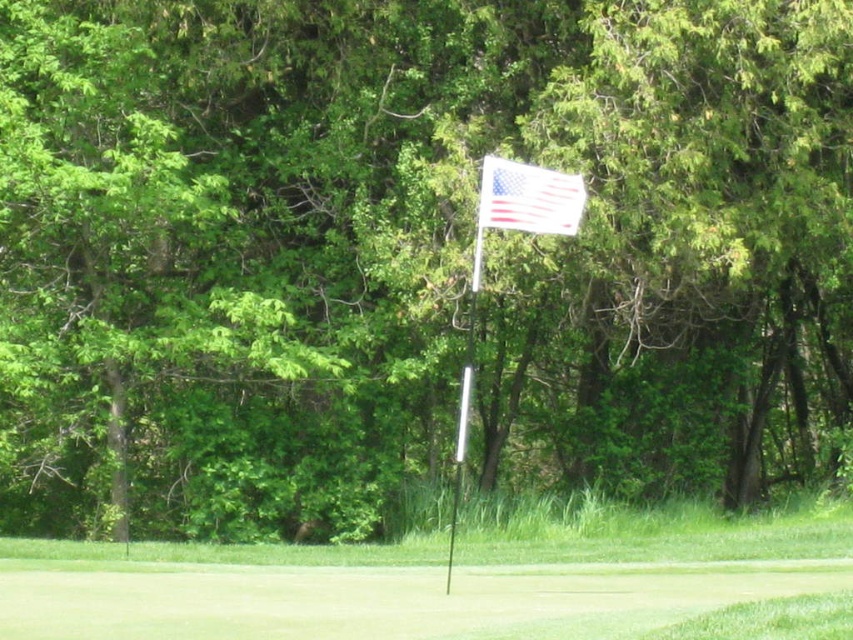
Does white fabric flag at upper center have a greater width compared to silver metallic flag pole at center?

Yes, white fabric flag at upper center is wider than silver metallic flag pole at center.

From the picture: Can you confirm if white fabric flag at upper center is positioned to the right of silver metallic flag pole at center?

Correct, you'll find white fabric flag at upper center to the right of silver metallic flag pole at center.

Describe the element at coordinates (529, 196) in the screenshot. The height and width of the screenshot is (640, 853). I see `white fabric flag at upper center` at that location.

Find the location of `white fabric flag at upper center`. white fabric flag at upper center is located at coordinates (529, 196).

Is point (663, 561) in front of point (502, 168)?

That is False.

Measure the distance from white plastic flag at center to white fabric flag at upper center.

white plastic flag at center is 11.15 feet away from white fabric flag at upper center.

Between point (374, 609) and point (548, 186), which one is positioned behind?

The point (548, 186) is behind.

Locate an element on the screen. This screenshot has width=853, height=640. white plastic flag at center is located at coordinates (407, 586).

Does white plastic flag at center have a greater height compared to silver metallic flag pole at center?

No, white plastic flag at center is not taller than silver metallic flag pole at center.

Who is shorter, white plastic flag at center or silver metallic flag pole at center?

white plastic flag at center is shorter.

Who is more distant from viewer, (618, 572) or (479, 228)?

The point (618, 572) is behind.

Where is `white plastic flag at center`? This screenshot has width=853, height=640. white plastic flag at center is located at coordinates (407, 586).